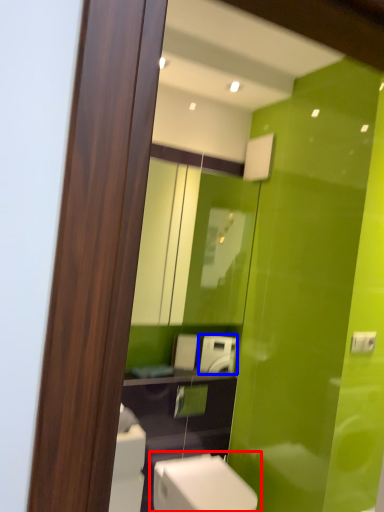
Question: Which object appears closest to the camera in this image, toilet (highlighted by a red box) or appliance (highlighted by a blue box)?

Choices:
 (A) toilet
 (B) appliance

Answer: (A)